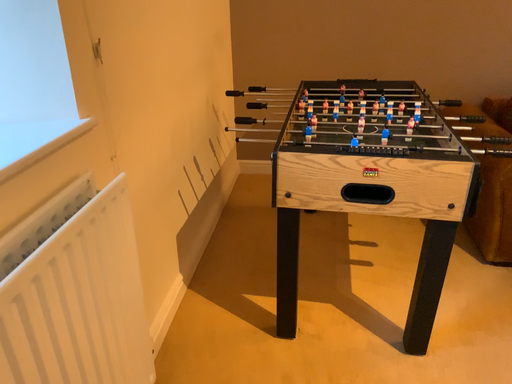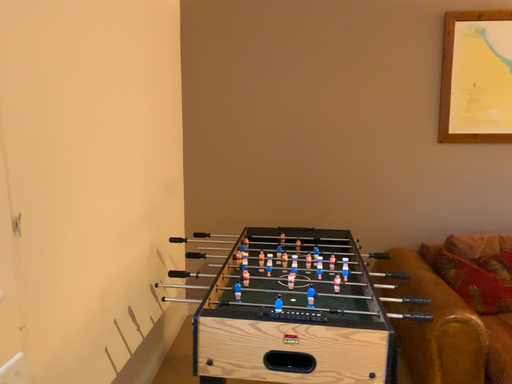
Question: Which way did the camera rotate in the video?

Choices:
 (A) rotated upward
 (B) rotated downward

Answer: (A)